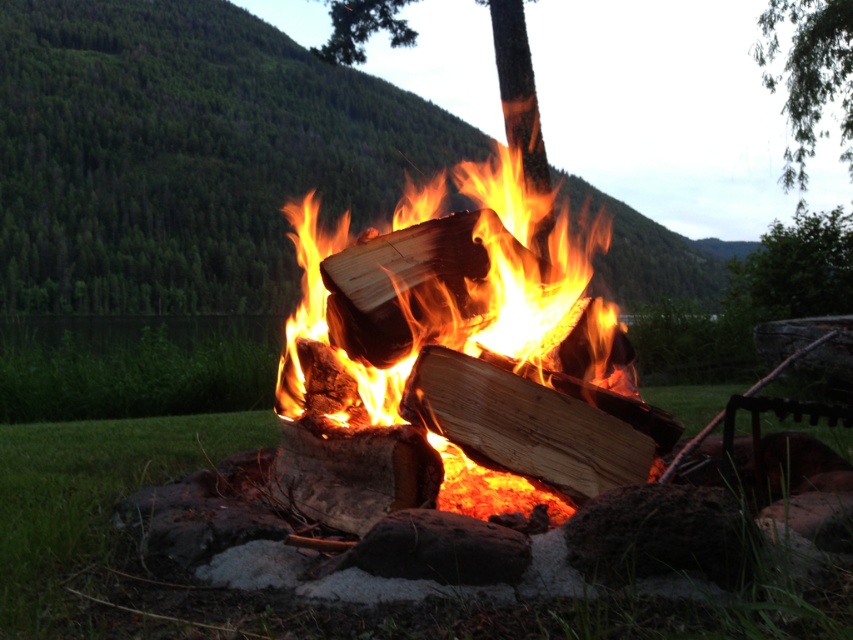
You are standing near the campfire and want to know if the charred wood fire at center will reach the top of the green leafy tree at upper right. Based on their sizes, what can you conclude?

The charred wood fire at center is much taller than the green leafy tree at upper right, so it will likely reach the top of the tree.

You are standing in front of the campfire scene. There are two points marked in the image, one at coordinate point (421, 225) and another at point (839, 13). Which point is closer to you?

Point (421, 225) is closer to the viewer than point (839, 13).

You are planning to roast marshmallows over the fire. Which object, the charred wood fire at center or the natural wood at center, is more suitable for holding the marshmallow skewer?

The charred wood fire at center is more suitable for holding the marshmallow skewer because it is wider than the natural wood at center, providing a safer and more stable base.